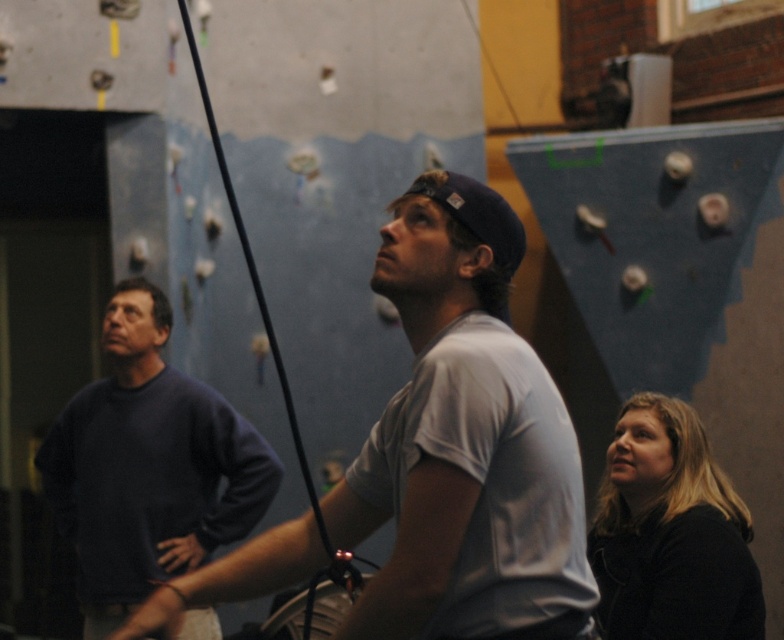
Question: Does gray cotton t-shirt at center appear under black matte jacket at lower right?

Choices:
 (A) yes
 (B) no

Answer: (B)

Question: Among these objects, which one is farthest from the camera?

Choices:
 (A) dark blue sweater at left
 (B) black matte jacket at lower right
 (C) gray cotton t-shirt at center

Answer: (A)

Question: Can you confirm if dark blue sweater at left is positioned to the left of black matte jacket at lower right?

Choices:
 (A) no
 (B) yes

Answer: (B)

Question: Which point is farther to the camera?

Choices:
 (A) (645, 396)
 (B) (111, 426)

Answer: (B)

Question: Does gray cotton t-shirt at center appear on the right side of black matte jacket at lower right?

Choices:
 (A) yes
 (B) no

Answer: (B)

Question: Which point is farther to the camera?

Choices:
 (A) (699, 602)
 (B) (162, 628)
 (C) (111, 433)

Answer: (C)